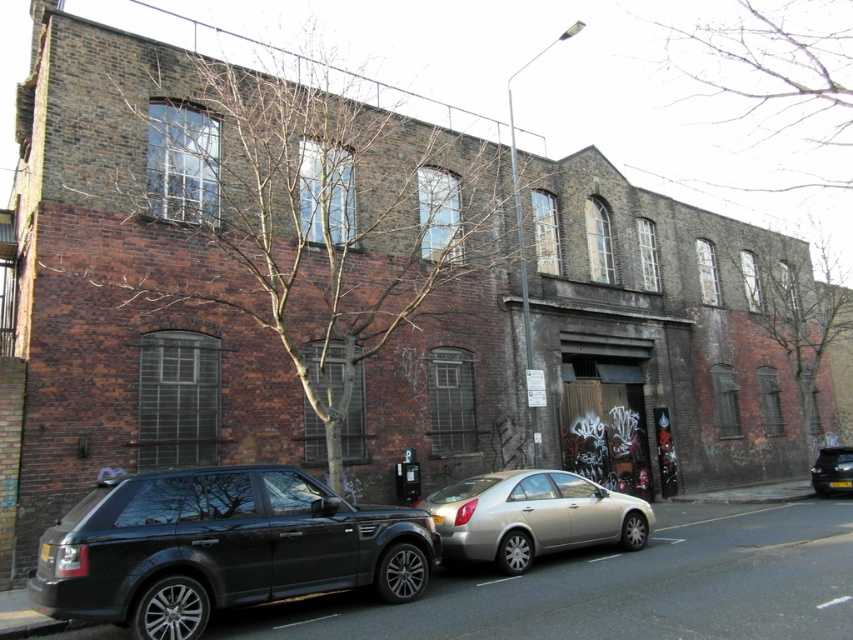
Question: Observing the image, what is the correct spatial positioning of shiny black suv at lower left in reference to metallic silver sedan at lower right?

Choices:
 (A) left
 (B) right

Answer: (A)

Question: Which object is farther from the camera taking this photo?

Choices:
 (A) shiny black suv at lower left
 (B) metallic silver sedan at lower right
 (C) silver metallic sedan at center

Answer: (B)

Question: Which point appears farthest from the camera in this image?

Choices:
 (A) (527, 493)
 (B) (838, 476)
 (C) (141, 524)

Answer: (B)

Question: Does silver metallic sedan at center have a smaller size compared to metallic silver sedan at lower right?

Choices:
 (A) yes
 (B) no

Answer: (B)

Question: Is shiny black suv at lower left closer to the viewer compared to silver metallic sedan at center?

Choices:
 (A) no
 (B) yes

Answer: (B)

Question: Which of the following is the closest to the observer?

Choices:
 (A) (587, 496)
 (B) (817, 486)

Answer: (A)